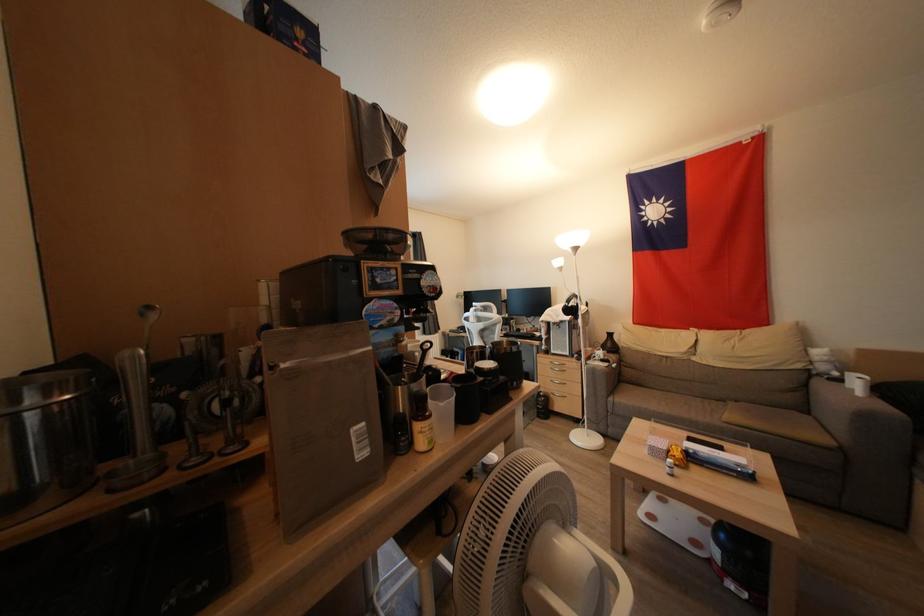
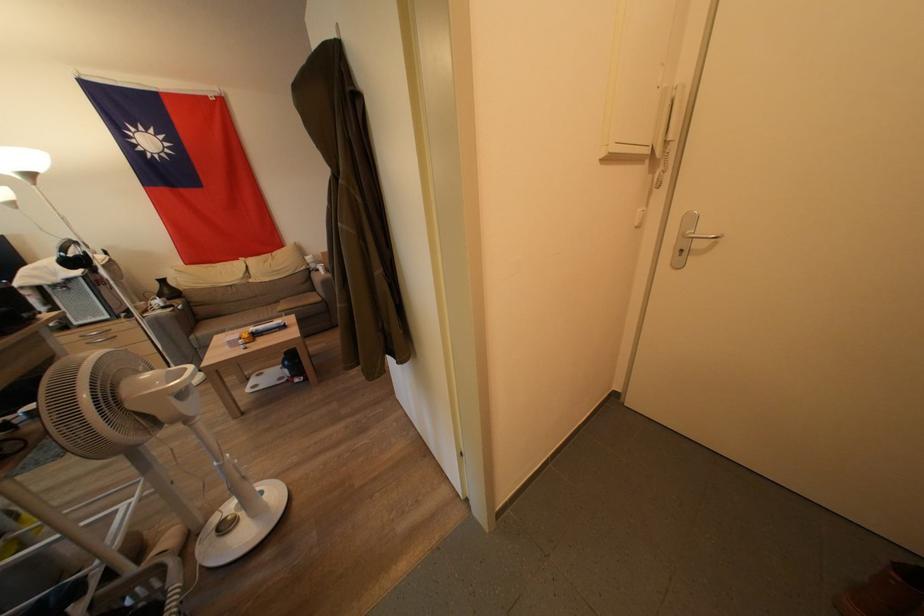
In the second image, find the point that corresponds to point (556, 355) in the first image.

(81, 328)